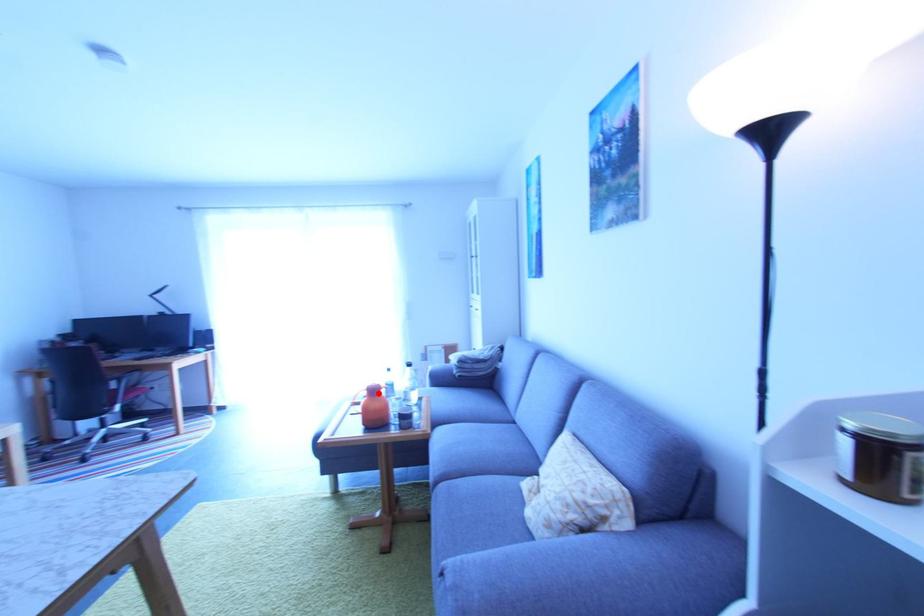
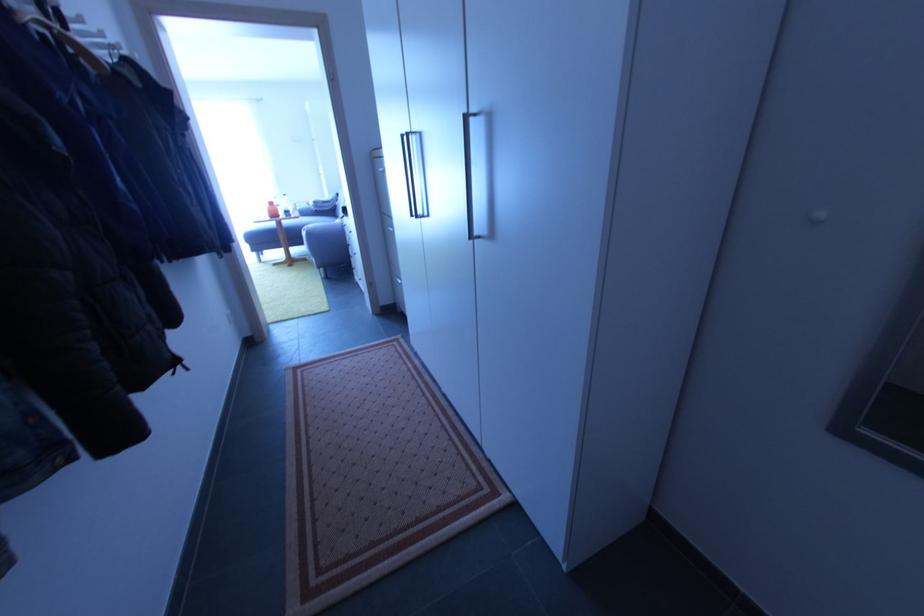
The point at the highlighted location is marked in the first image. Where is the corresponding point in the second image?

(275, 205)